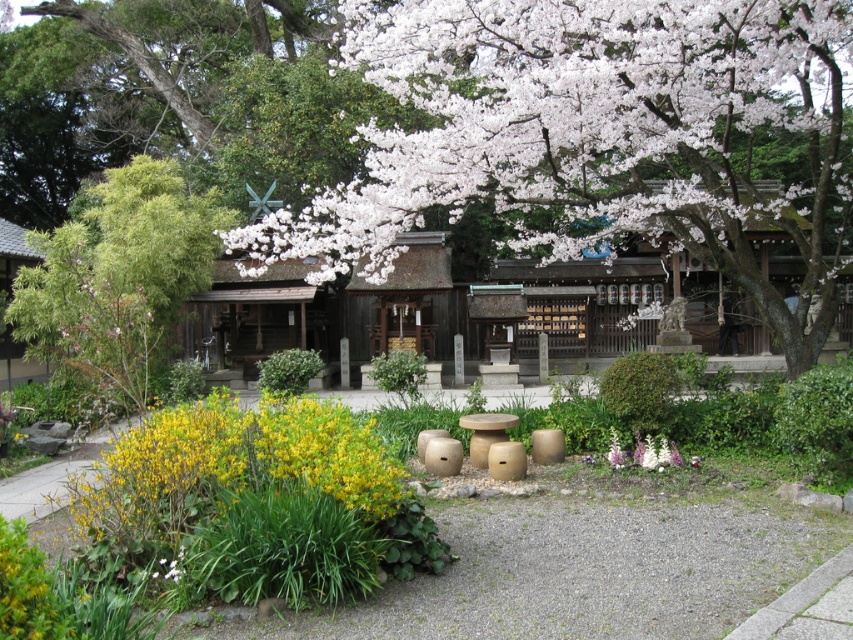
From the picture: You are a visitor at the Japanese garden and notice the white petal blossom at center and the yellow matte flowers at lower left. Which of these two flowers is located to the right side of the other?

The white petal blossom at center is positioned on the right side of yellow matte flowers at lower left.

You are a gardener planning to plant a new flower bed. You have two flowers to choose from in the image, the white petal blossom at center and the white matte flower at lower left. Which flower should you select if you want a larger bloom for your garden?

The white petal blossom at center has a larger size compared to the white matte flower at lower left, so you should choose the white petal blossom at center for a larger bloom in your garden.

You are standing at the camera position in the Japanese garden scene. There is a point marked at coordinates point (x=656, y=180). Can you walk directly to this point without moving around any obstacles?

The point (x=656, y=180) is 16.78 meters away from the camera. Since there are no obstacles mentioned between the camera and the point, you can walk directly to it.